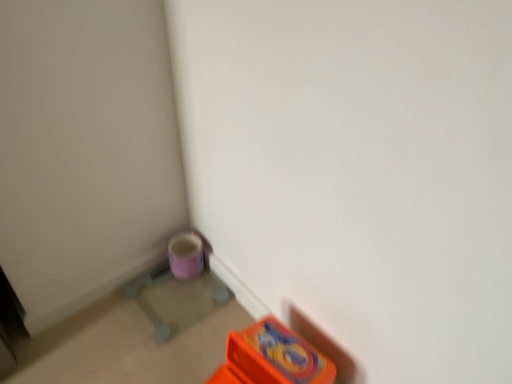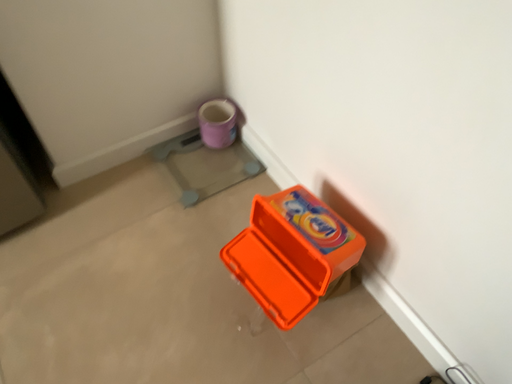
Question: How did the camera likely rotate when shooting the video?

Choices:
 (A) rotated upward
 (B) rotated downward

Answer: (B)